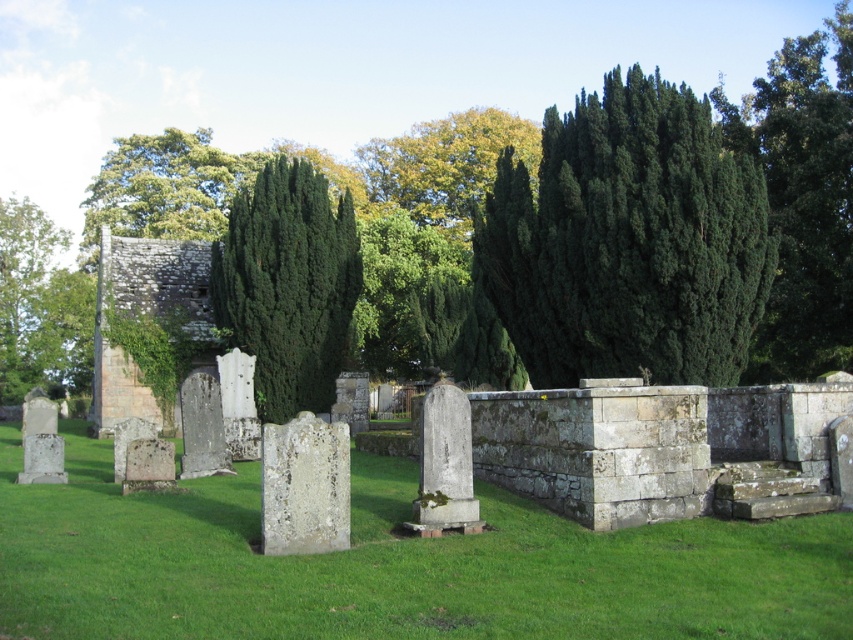
Does green leafy tree at upper right have a lesser width compared to green leafy tree at upper left?

→ Incorrect, green leafy tree at upper right's width is not less than green leafy tree at upper left's.

The width and height of the screenshot is (853, 640). I want to click on green leafy tree at upper right, so click(x=802, y=200).

Who is more forward, (x=799, y=67) or (x=250, y=154)?

Point (x=799, y=67) is more forward.

This screenshot has height=640, width=853. In order to click on green leafy tree at upper right in this screenshot , I will do `click(802, 200)`.

Does green leafy tree at upper right appear over white stone gravestone at center?

Yes.

Is point (762, 369) positioned after point (279, 502)?

Yes, it is behind point (279, 502).

Who is more distant from viewer, (750, 93) or (331, 480)?

Positioned behind is point (750, 93).

Find the location of `green leafy tree at upper right`. green leafy tree at upper right is located at coordinates 802,200.

Is green leafy tree at upper right smaller than green leafy tree at center?

No.

What do you see at coordinates (802, 200) in the screenshot? This screenshot has width=853, height=640. I see `green leafy tree at upper right` at bounding box center [802, 200].

The image size is (853, 640). In order to click on green leafy tree at upper right in this screenshot , I will do `click(802, 200)`.